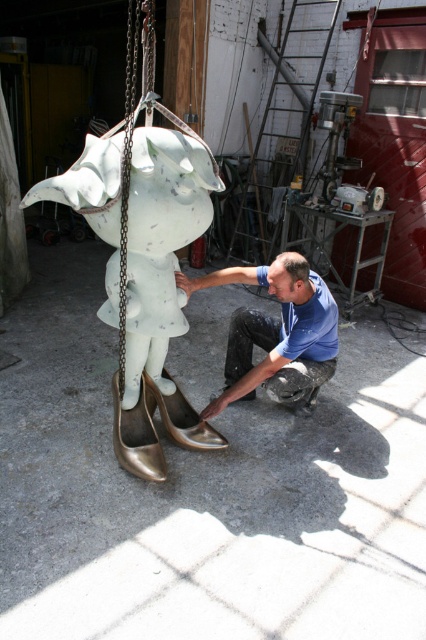
Who is higher up, metallic chain at center or gold metallic shoe at lower left?

metallic chain at center is above.

Between metallic chain at center and gold metallic shoe at lower left, which one appears on the left side from the viewer's perspective?

Positioned to the left is metallic chain at center.

In order to click on metallic chain at center in this screenshot , I will do `click(132, 141)`.

Is metallic chain at center below shiny gold shoe at lower center?

No.

Which of these two, metallic chain at center or shiny gold shoe at lower center, stands shorter?

metallic chain at center is shorter.

The image size is (426, 640). What do you see at coordinates (132, 141) in the screenshot? I see `metallic chain at center` at bounding box center [132, 141].

You are a GUI agent. You are given a task and a screenshot of the screen. Output one action in this format:
    pyautogui.click(x=<x>, y=<y>)
    Task: Click on the metallic chain at center
    
    Given the screenshot: What is the action you would take?
    pyautogui.click(x=132, y=141)

Consider the image. Who is lower down, blue matte shirt at lower center or gold shiny shoe at lower left?

gold shiny shoe at lower left

Does blue matte shirt at lower center have a greater height compared to gold shiny shoe at lower left?

Indeed, blue matte shirt at lower center has a greater height compared to gold shiny shoe at lower left.

Between point (273, 273) and point (198, 420), which one is positioned in front?

Point (273, 273) is more forward.

I want to click on blue matte shirt at lower center, so click(271, 323).